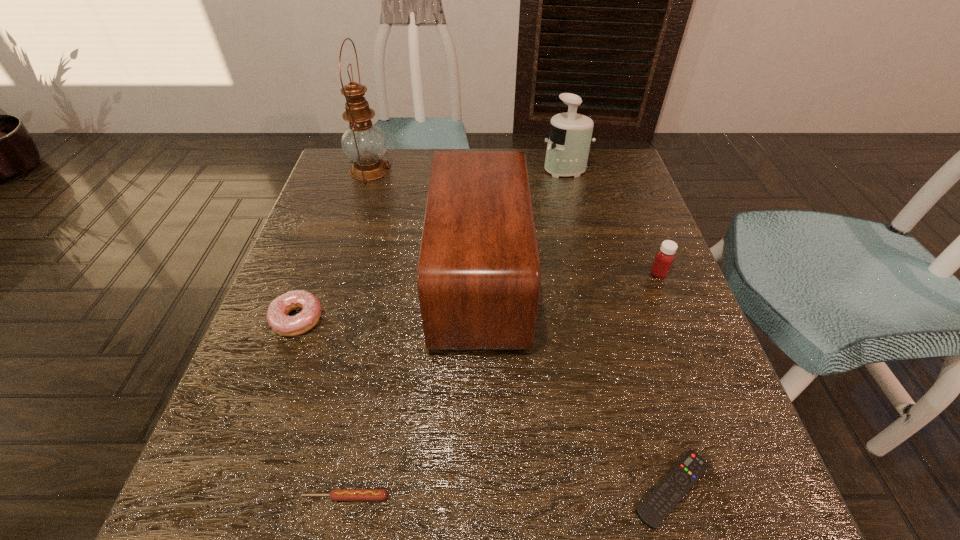
Locate an element on the screen. free spot located 0.240m on the front panel of the radio receiver is located at coordinates pyautogui.click(x=636, y=280).

In order to click on free space located 0.320m on the left of the medicine in this screenshot , I will do `click(503, 273)`.

Identify the location of blank space located 0.300m on the right of the third shortest object. The image size is (960, 540). (475, 319).

At what (x,y) coordinates should I click in order to perform the action: click on free space located 0.080m on the back of the sixth tallest object. Please return your answer as a coordinate pair (x, y). Image resolution: width=960 pixels, height=540 pixels. Looking at the image, I should click on (357, 438).

Image resolution: width=960 pixels, height=540 pixels. Find the location of `free spot located on the back of the shortest object`. free spot located on the back of the shortest object is located at coordinates (639, 373).

Locate an element on the screen. The height and width of the screenshot is (540, 960). oil lamp that is at the far edge is located at coordinates (364, 143).

Find the location of `juicer located at the far edge`. juicer located at the far edge is located at coordinates (570, 135).

Find the location of a particular element. sausage located at the near edge is located at coordinates (336, 494).

Where is `remote control that is at the near edge`? The width and height of the screenshot is (960, 540). remote control that is at the near edge is located at coordinates (666, 495).

Image resolution: width=960 pixels, height=540 pixels. What are the coordinates of `oil lamp at the left edge` in the screenshot? It's located at (364, 143).